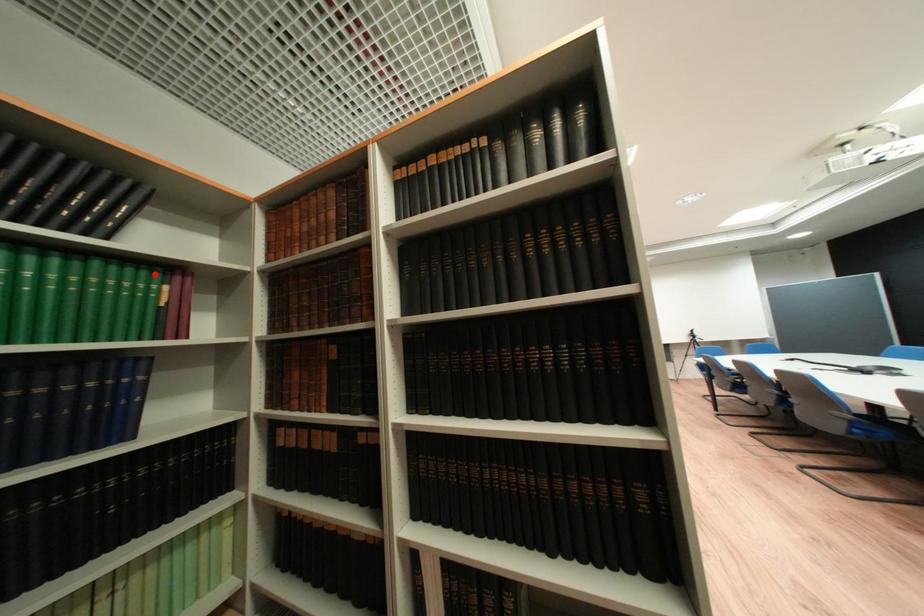
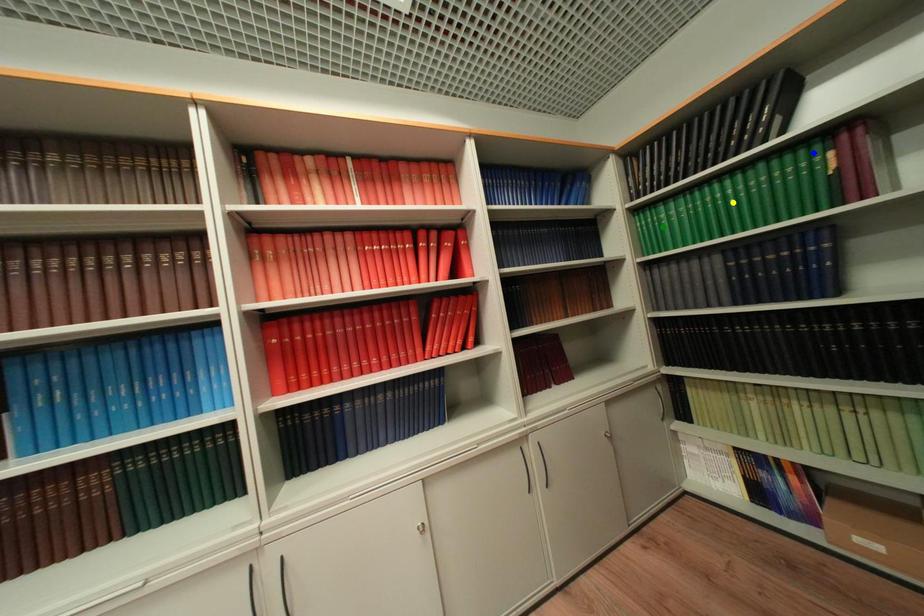
Question: I am providing you with two images of the same scene from different viewpoints. A red point is marked on the first image. You are given multiple points on the second image. Which spot in image 2 lines up with the point in image 1?

Choices:
 (A) green point
 (B) yellow point
 (C) blue point

Answer: (C)